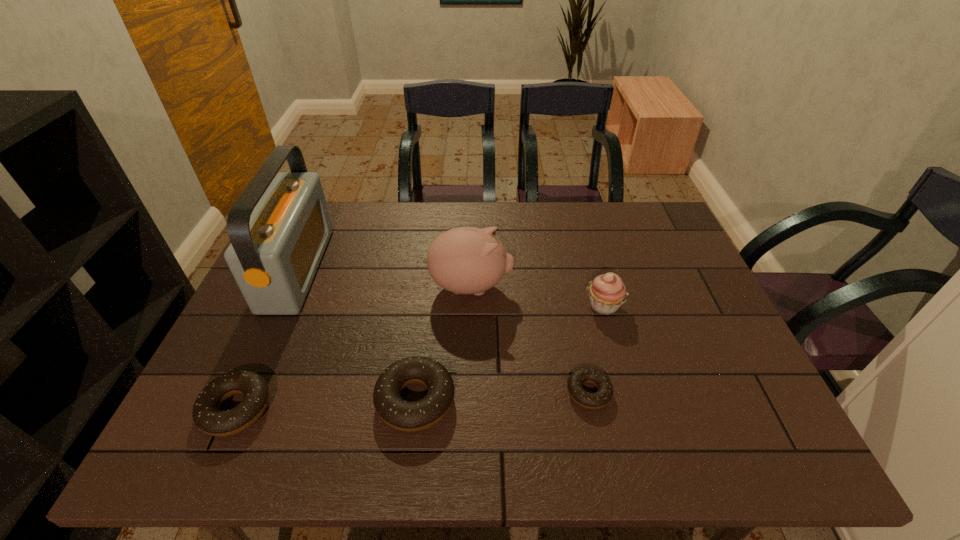
What are the coordinates of `free space at the near edge of the desktop` in the screenshot? It's located at (405, 393).

Identify the location of vacant space at the right edge of the desktop. (688, 379).

At what (x,y) coordinates should I click in order to perform the action: click on vacant space at the far right corner of the desktop. Please return your answer as a coordinate pair (x, y). Image resolution: width=960 pixels, height=540 pixels. Looking at the image, I should click on (635, 225).

Find the location of a particular element. The image size is (960, 540). vacant space at the near right corner of the desktop is located at coordinates [x=766, y=401].

Identify the location of free space between the third tallest object and the piggy bank. (538, 296).

Find the location of a particular element. This screenshot has width=960, height=540. free space between the piggy bank and the fourth shortest object is located at coordinates (538, 296).

Locate an element on the screen. vacant space in between the fifth tallest object and the tallest object is located at coordinates (268, 339).

Locate an element on the screen. This screenshot has width=960, height=540. free point between the fifth shortest object and the second shortest doughnut is located at coordinates (354, 348).

Locate an element on the screen. The width and height of the screenshot is (960, 540). empty space that is in between the shortest doughnut and the second tallest object is located at coordinates (530, 340).

Image resolution: width=960 pixels, height=540 pixels. Identify the location of empty space that is in between the piggy bank and the cupcake. (538, 296).